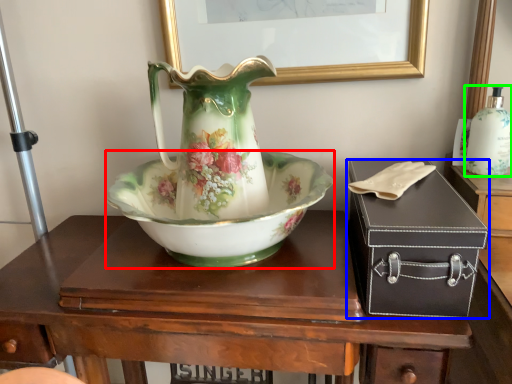
Question: Which object is positioned farthest from bowl (highlighted by a red box)? Select from box (highlighted by a blue box) and bottle (highlighted by a green box).

Choices:
 (A) box
 (B) bottle

Answer: (B)